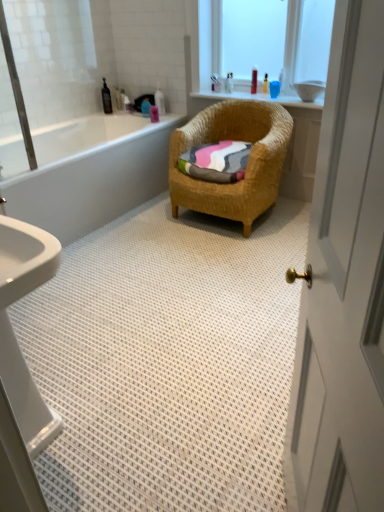
Question: Should I look upward or downward to see translucent plastic bottle at upper center, which is the 5th toiletry from left to right?

Choices:
 (A) down
 (B) up

Answer: (B)

Question: Considering the relative sizes of white glossy door at right and multicolored woven towel at center in the image provided, is white glossy door at right smaller than multicolored woven towel at center?

Choices:
 (A) no
 (B) yes

Answer: (A)

Question: Is multicolored woven towel at center completely or partially inside white glossy door at right?

Choices:
 (A) yes
 (B) no

Answer: (B)

Question: Is white glossy door at right at the right side of multicolored woven towel at center?

Choices:
 (A) no
 (B) yes

Answer: (B)

Question: Does white glossy door at right appear on the left side of multicolored woven towel at center?

Choices:
 (A) yes
 (B) no

Answer: (B)

Question: Considering the relative sizes of white glossy door at right and multicolored woven towel at center in the image provided, is white glossy door at right taller than multicolored woven towel at center?

Choices:
 (A) no
 (B) yes

Answer: (B)

Question: Does white glossy door at right have a larger size compared to multicolored woven towel at center?

Choices:
 (A) no
 (B) yes

Answer: (B)

Question: Is blue plastic bottle at upper center, placed as the second toiletry when sorted from left to right, positioned behind white glossy door at right?

Choices:
 (A) no
 (B) yes

Answer: (B)

Question: Is blue plastic bottle at upper center, placed as the second toiletry when sorted from left to right, closer to camera compared to white glossy door at right?

Choices:
 (A) yes
 (B) no

Answer: (B)

Question: From the image's perspective, is blue plastic bottle at upper center, which appears as the 6th toiletry when viewed from the right, located above white glossy door at right?

Choices:
 (A) yes
 (B) no

Answer: (A)

Question: Is blue plastic bottle at upper center, placed as the second toiletry when sorted from left to right, not near white glossy door at right?

Choices:
 (A) no
 (B) yes

Answer: (B)

Question: Is blue plastic bottle at upper center, placed as the second toiletry when sorted from left to right, taller than white glossy door at right?

Choices:
 (A) no
 (B) yes

Answer: (A)

Question: From a real-world perspective, is blue plastic bottle at upper center, placed as the second toiletry when sorted from left to right, over white glossy door at right?

Choices:
 (A) no
 (B) yes

Answer: (A)

Question: Is black plastic bottle at upper left, placed as the 1th toiletry when sorted from left to right, with white glossy door at right?

Choices:
 (A) yes
 (B) no

Answer: (B)